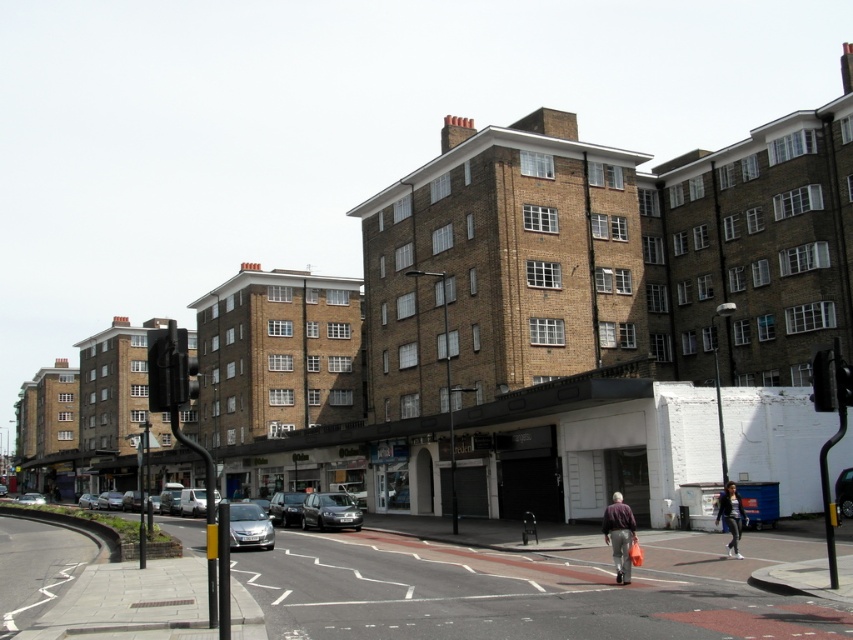
Is shiny black car at center in front of silver metallic van at lower left?

No, it is not.

Is shiny black car at center thinner than silver metallic van at lower left?

Correct, shiny black car at center's width is less than silver metallic van at lower left's.

Is point (271, 502) farther from camera compared to point (213, 499)?

Yes, it is behind point (213, 499).

Identify the location of shiny black car at center. The height and width of the screenshot is (640, 853). (286, 508).

Who is more distant from viewer, (624,525) or (86,496)?

The point (86,496) is more distant.

Does striped sweater at center have a lesser width compared to silver metallic car at lower left?

Correct, striped sweater at center's width is less than silver metallic car at lower left's.

Identify the location of striped sweater at center. (619, 536).

Is striped sweater at center smaller than black plastic traffic light at right?

Yes, striped sweater at center is smaller than black plastic traffic light at right.

Who is higher up, striped sweater at center or black plastic traffic light at right?

black plastic traffic light at right is higher up.

Is point (621, 560) farther from viewer compared to point (830, 364)?

Yes, it is behind point (830, 364).

You are a GUI agent. You are given a task and a screenshot of the screen. Output one action in this format:
    pyautogui.click(x=<x>, y=<y>)
    Task: Click on the striped sweater at center
    The image size is (853, 640).
    Given the screenshot: What is the action you would take?
    pyautogui.click(x=619, y=536)